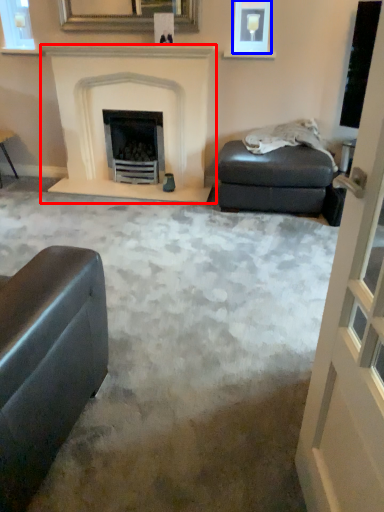
Question: Which object appears farthest to the camera in this image, fireplace (highlighted by a red box) or picture frame (highlighted by a blue box)?

Choices:
 (A) fireplace
 (B) picture frame

Answer: (B)